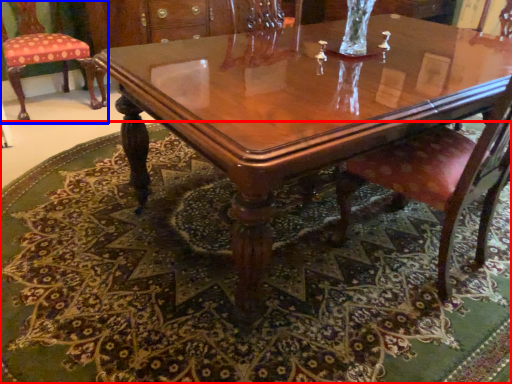
Question: Which of the following is the closest to the observer, mat (highlighted by a red box) or chair (highlighted by a blue box)?

Choices:
 (A) mat
 (B) chair

Answer: (A)